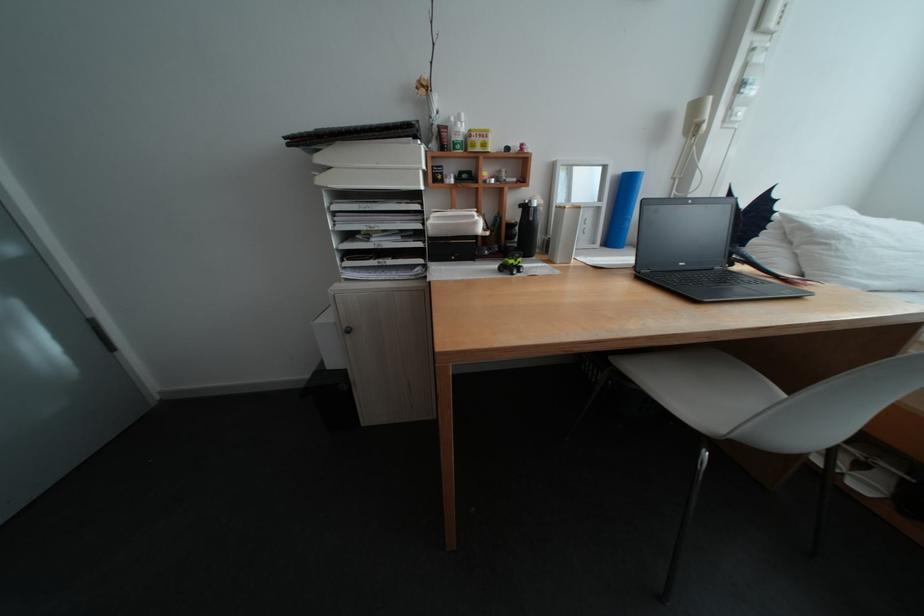
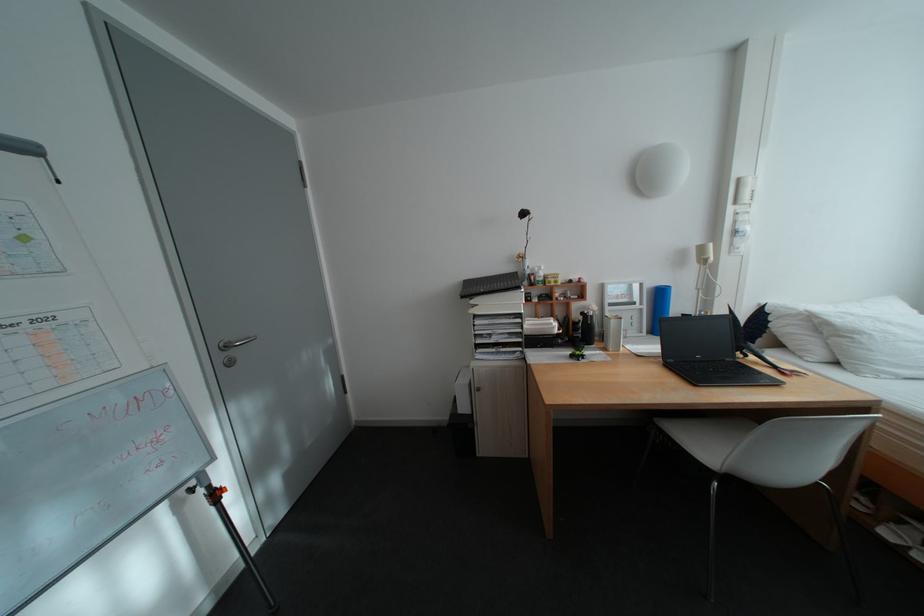
Question: In a continuous first-person perspective shot, in which direction is the camera moving?

Choices:
 (A) Left
 (B) Right
 (C) Forward
 (D) Backward

Answer: (D)